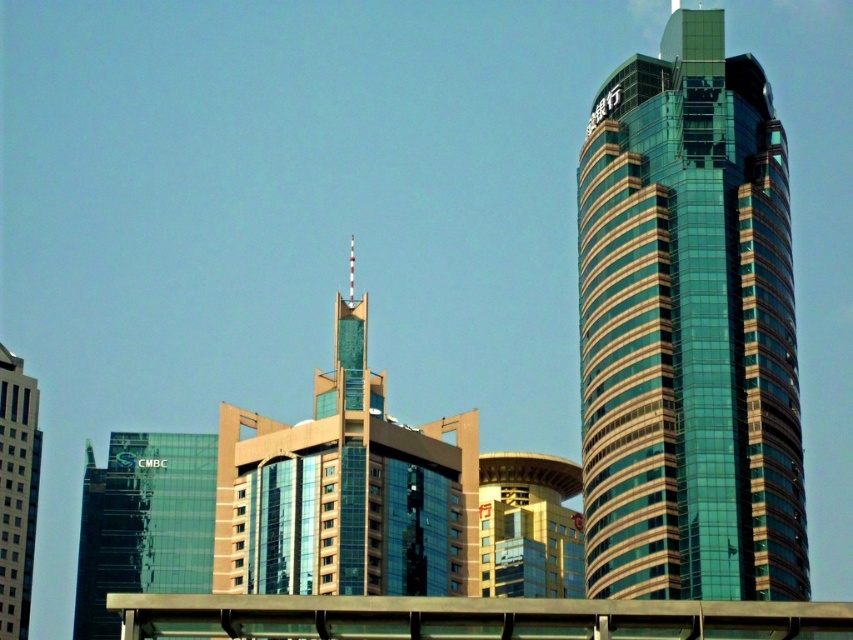
Looking at this image, you are standing in the city square between the two skyscrapers. If you look towards the transparent glass building at left, which direction would the green glass skyscraper at right be relative to it?

The green glass skyscraper at right is in front of the transparent glass building at left, so it would appear to be to the right and in front of it when viewed from the city square.

You are standing in front of a green glass skyscraper at right. If you want to take a photo of it from a distance of 100 meters, should you move closer or farther away?

The current distance between you and the green glass skyscraper at right is 80.75 meters. To achieve a 100 meter distance, you need to move farther away from the green glass skyscraper at right.